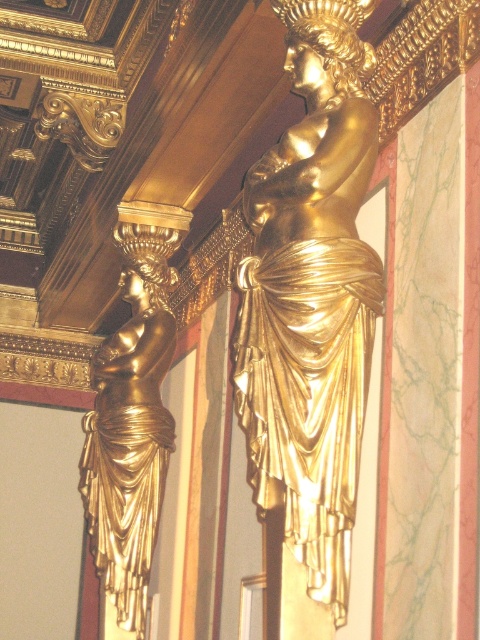
You are an architect analyzing the placement of two points on a wall with vertical stripes. The points are labeled as point 1 at coordinates point (x=355, y=461) and point 2 at point (x=87, y=480). Given the scene described, which point is nearer to the viewer?

Point 1 at coordinates point (x=355, y=461) is closer to the viewer than point 2 at point (x=87, y=480) based on the spatial description provided.